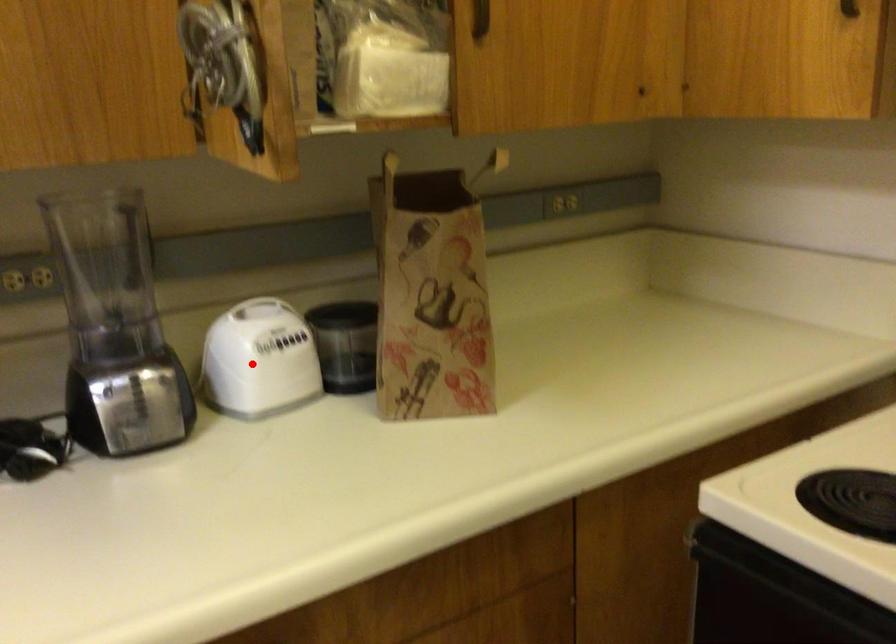
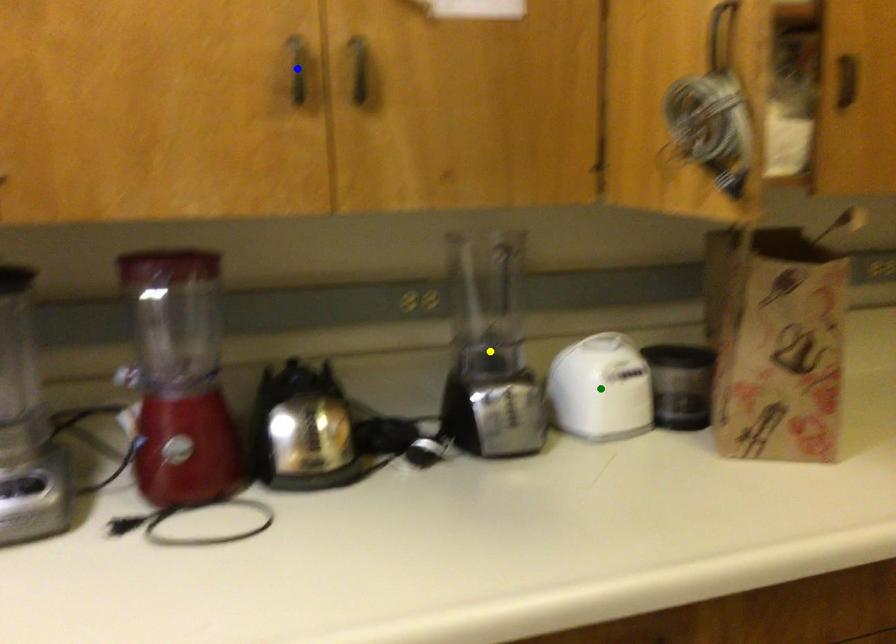
Question: I am providing you with two images of the same scene from different viewpoints. A red point is marked on the first image. You are given multiple points on the second image. Which point in image 2 represents the same 3d spot as the red point in image 1?

Choices:
 (A) blue point
 (B) green point
 (C) yellow point

Answer: (B)